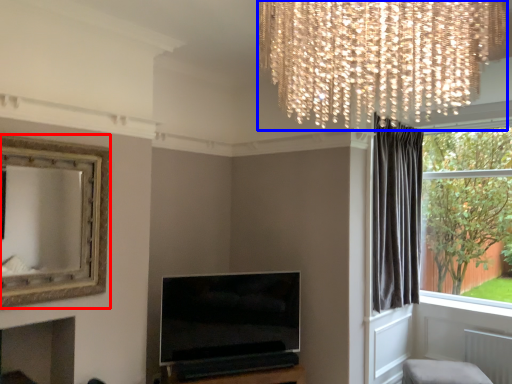
Question: Which object is further to the camera taking this photo, picture frame (highlighted by a red box) or lamp (highlighted by a blue box)?

Choices:
 (A) picture frame
 (B) lamp

Answer: (A)